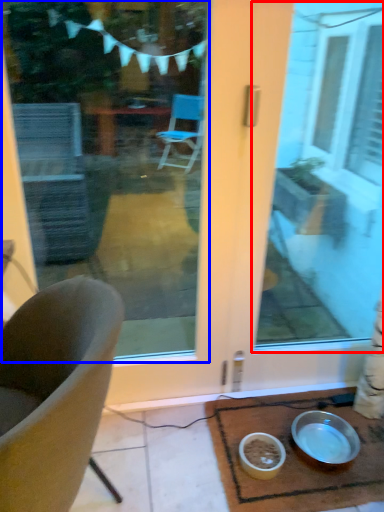
Question: Which object appears farthest to the camera in this image, window screen (highlighted by a red box) or window screen (highlighted by a blue box)?

Choices:
 (A) window screen
 (B) window screen

Answer: (A)